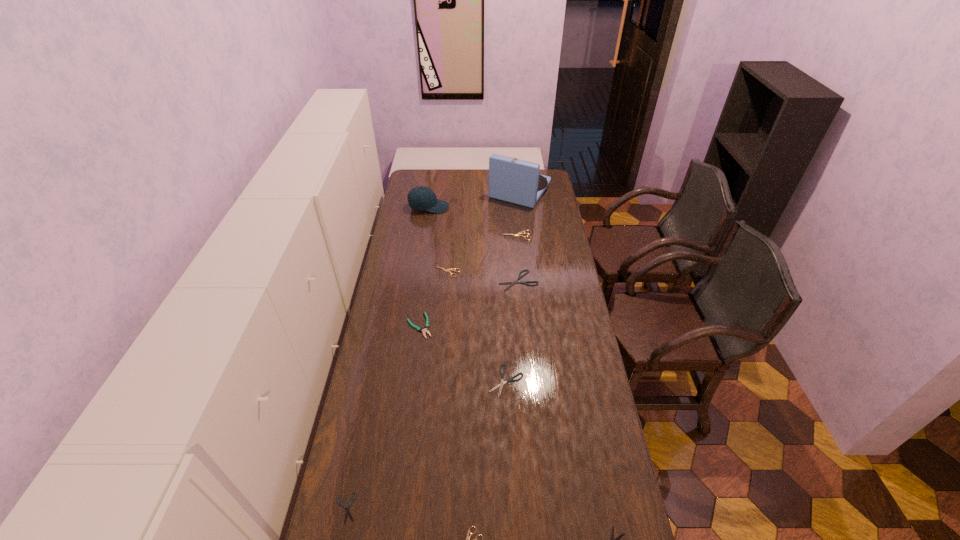
You are a GUI agent. You are given a task and a screenshot of the screen. Output one action in this format:
    pyautogui.click(x=<x>, y=<y>)
    Task: Click on the vacant space situated 0.390m on the front of the second smallest beige shears
    
    Given the screenshot: What is the action you would take?
    pyautogui.click(x=442, y=346)

Identify the location of free space located 0.300m on the left of the third nearest black shears. This screenshot has width=960, height=540. (405, 381).

I want to click on free point located on the right of the smallest black shears, so click(x=480, y=508).

At what (x,y) coordinates should I click in order to perform the action: click on object that is positioned at the far edge. Please return your answer as a coordinate pair (x, y). This screenshot has width=960, height=540. Looking at the image, I should click on (512, 180).

Find the location of a particular element. Image resolution: width=960 pixels, height=540 pixels. baseball cap that is positioned at the left edge is located at coordinates (419, 198).

Where is `pliers situated at the left edge`? pliers situated at the left edge is located at coordinates (424, 331).

What are the coordinates of `shears positioned at the left edge` in the screenshot? It's located at (347, 509).

Identify the location of object located in the right edge section of the desktop. The width and height of the screenshot is (960, 540). (512, 180).

Where is `object located at the far right corner`? object located at the far right corner is located at coordinates (512, 180).

In the image, there is a desktop. At what (x,y) coordinates should I click in order to perform the action: click on vacant space at the far edge. Please return your answer as a coordinate pair (x, y). The width and height of the screenshot is (960, 540). Looking at the image, I should click on (441, 175).